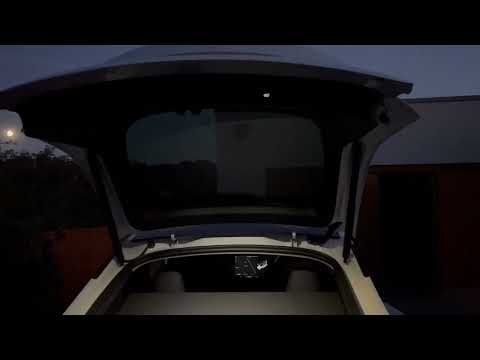
In order to click on window in this screenshot , I will do `click(154, 143)`.